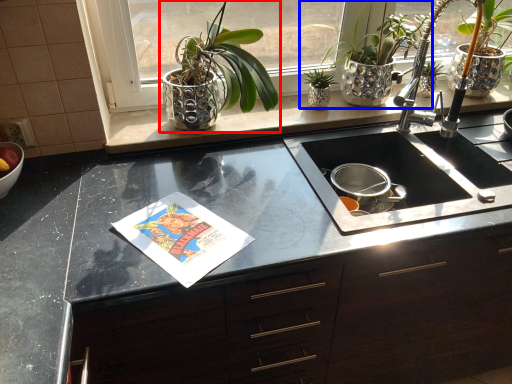
Question: Which object appears closest to the camera in this image, houseplant (highlighted by a red box) or houseplant (highlighted by a blue box)?

Choices:
 (A) houseplant
 (B) houseplant

Answer: (A)